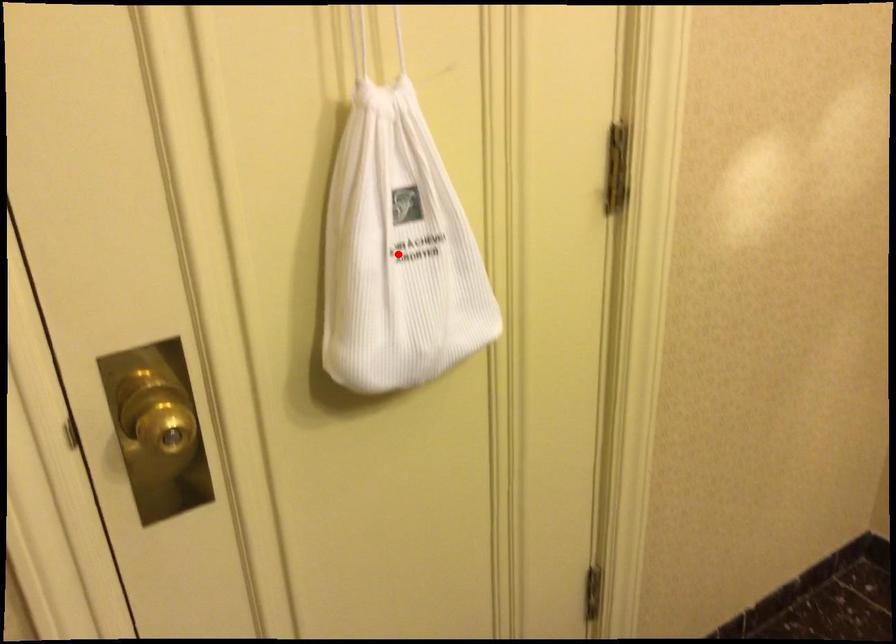
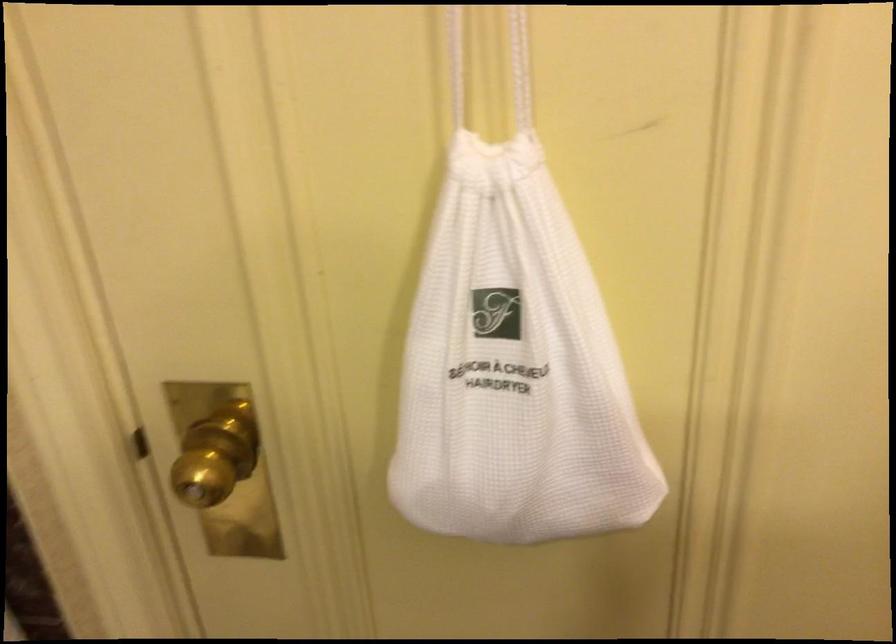
In the second image, find the point that corresponds to the highlighted location in the first image.

(513, 368)